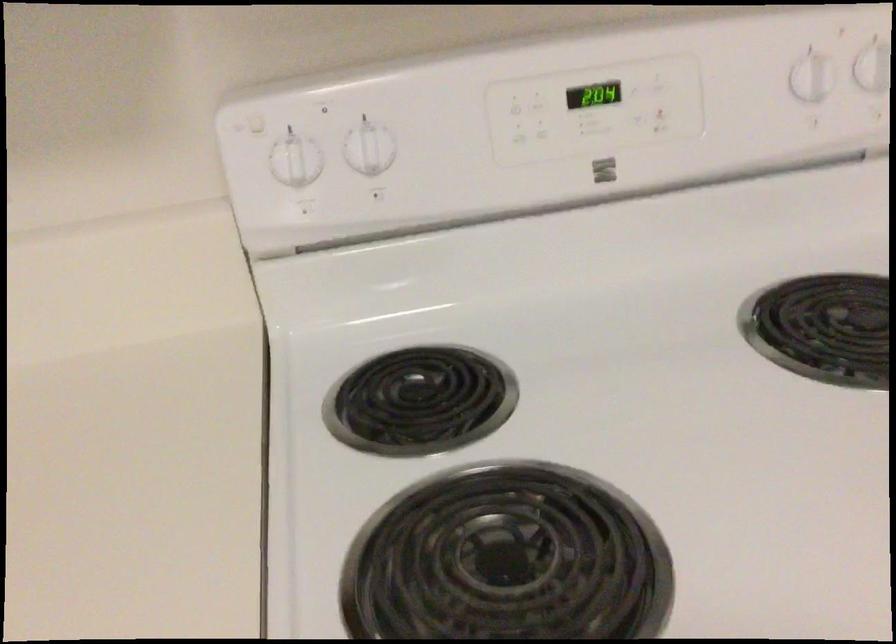
Image resolution: width=896 pixels, height=644 pixels. Describe the element at coordinates (604, 169) in the screenshot. I see `the square stove button` at that location.